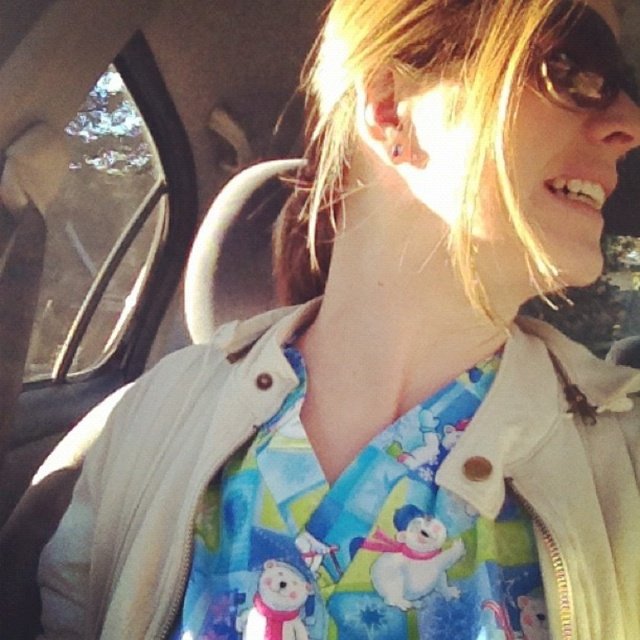
Is transparent glass car window at left to the left of transparent plastic goggles at upper right from the viewer's perspective?

Indeed, transparent glass car window at left is positioned on the left side of transparent plastic goggles at upper right.

Is transparent glass car window at left positioned at the back of transparent plastic goggles at upper right?

Yes, it is behind transparent plastic goggles at upper right.

At what (x,y) coordinates should I click in order to perform the action: click on transparent glass car window at left. Please return your answer as a coordinate pair (x, y). Looking at the image, I should click on tap(99, 234).

Find the location of `transparent glass car window at left`. transparent glass car window at left is located at coordinates (99, 234).